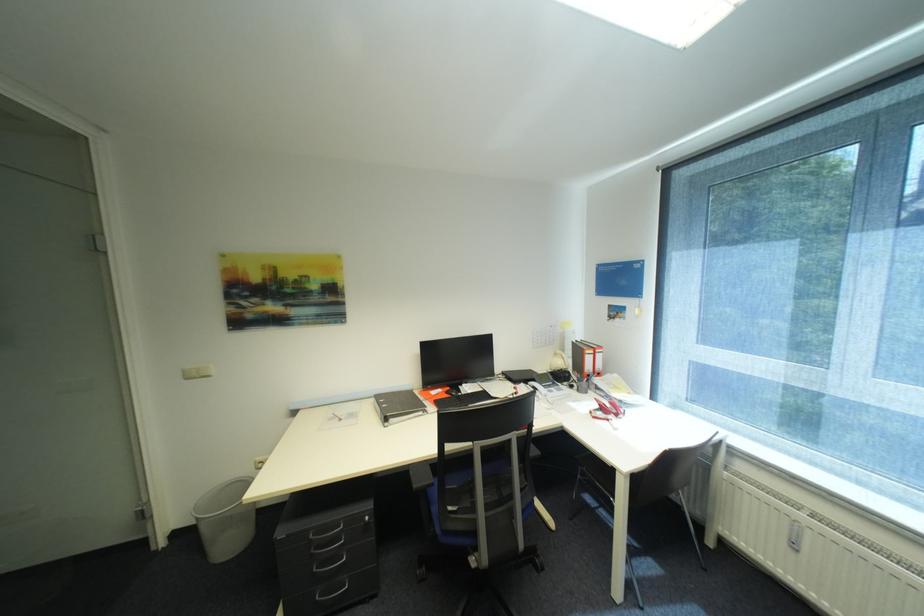
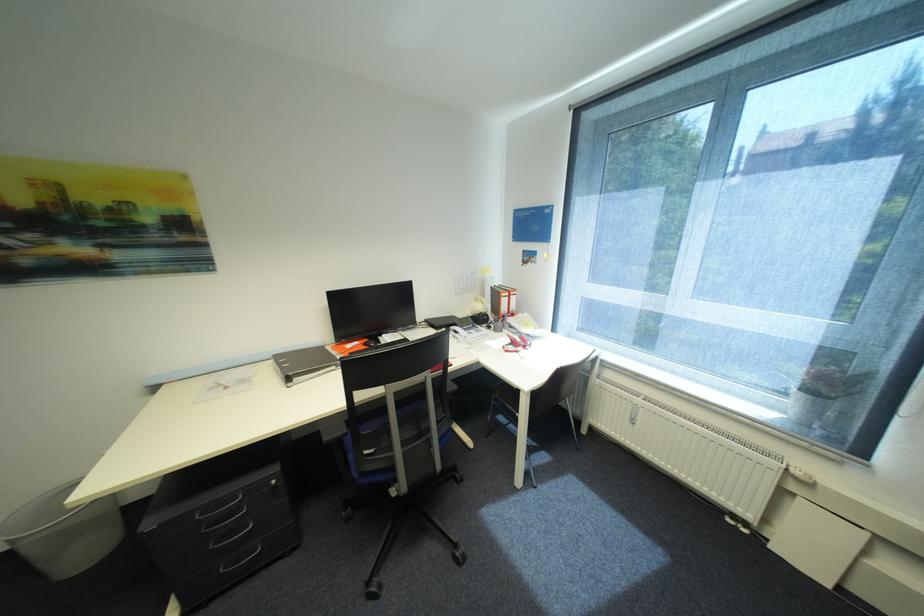
Where in the second image is the point corresponding to point 320,536 from the first image?

(205, 516)